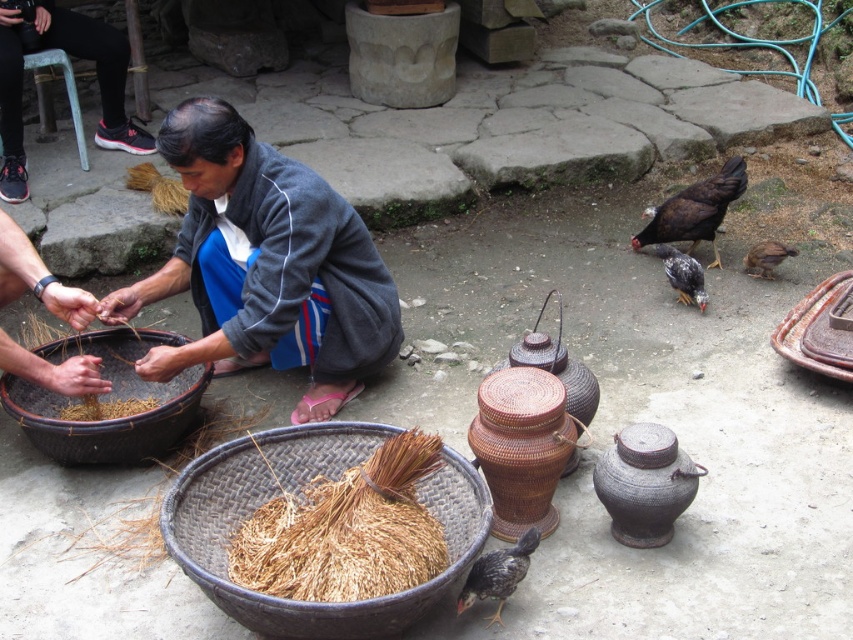
You are standing at the point marked as point (x=277, y=348). You want to throw a small ball to your friend who is at the other person. Will the ball travel more than 3 meters to reach them?

The distance between point (x=277, y=348) and the other person is 2.85 meters, so the ball will travel less than 3 meters to reach them.

You are organizing a craft fair and need to display two items from the image. The gray woven fabric at center and the woven brown pot at center must be placed on a shelf. If the shelf has limited height, which item should you place first to ensure both can fit?

The woven brown pot at center should be placed first since the gray woven fabric at center is taller, leaving less vertical space for the shorter item. By placing the shorter woven brown pot at center first, there will be enough remaining height to accommodate the taller gray woven fabric at center.

You are a photographer trying to capture the scene with a wide angle lens. To ensure both the gray woven fabric at center and the brown straw at lower left are in focus, which object should you focus on first? Please explain your reasoning based on their positions.

The gray woven fabric at center is located above the brown straw at lower left. Since the gray woven fabric at center is higher in the frame, focusing on it first would help ensure both objects remain in focus as it is closer to the lens compared to the lower positioned brown straw at lower left.